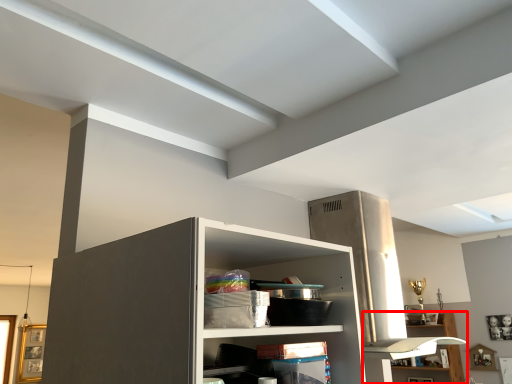
Question: From the image's perspective, what is the correct spatial relationship of shelf (annotated by the red box) in relation to shelf?

Choices:
 (A) below
 (B) above

Answer: (A)